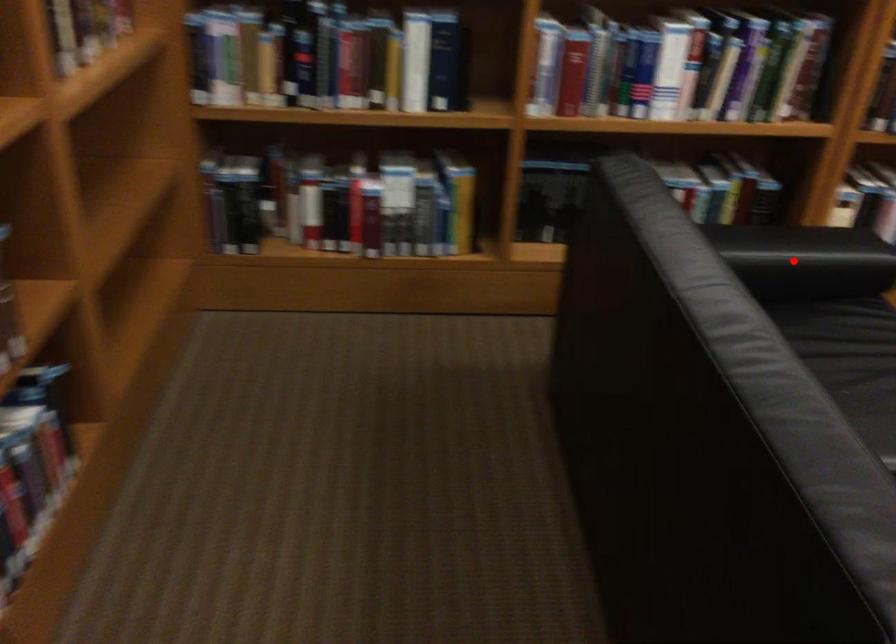
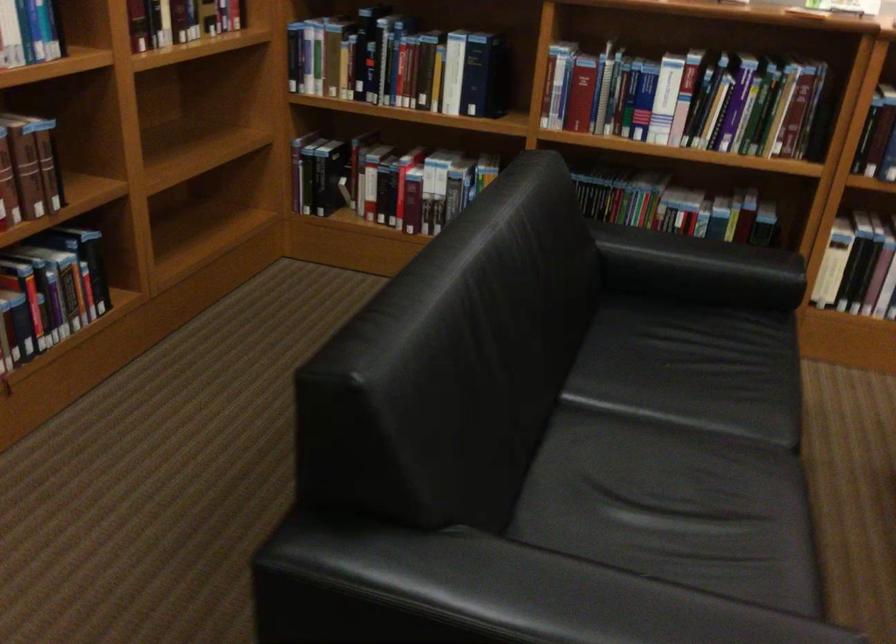
Question: I am providing you with two images of the same scene from different viewpoints. A red point is shown in image1. For the corresponding object point in image2, is it positioned nearer or farther from the camera?

Choices:
 (A) Nearer
 (B) Farther

Answer: (B)